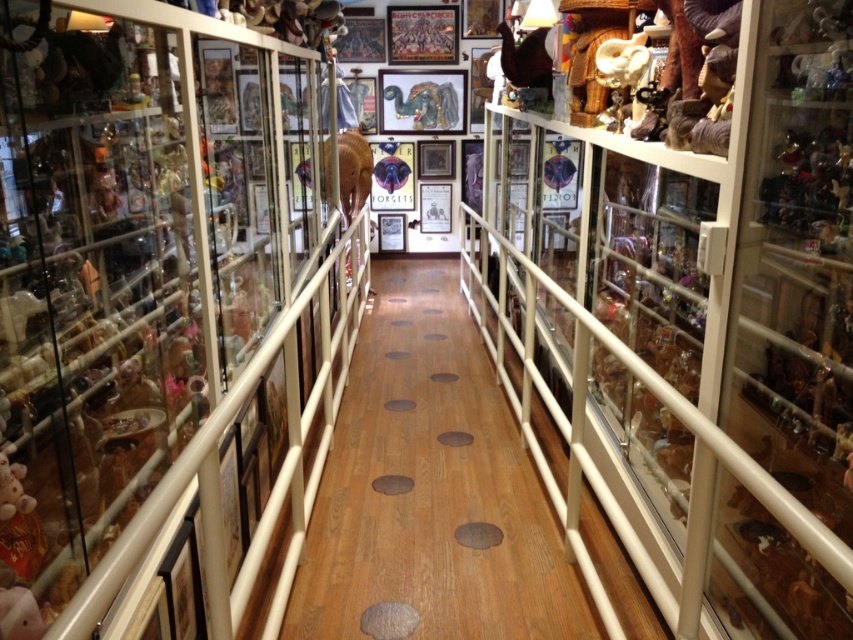
Question: Can you confirm if clear glass shelves at center is bigger than matte brown elephant at center?

Choices:
 (A) yes
 (B) no

Answer: (A)

Question: Does clear glass shelves at center have a lesser width compared to matte brown elephant at center?

Choices:
 (A) yes
 (B) no

Answer: (B)

Question: Among these points, which one is nearest to the camera?

Choices:
 (A) (148, 376)
 (B) (328, 186)

Answer: (A)

Question: Is clear glass shelves at center closer to the viewer compared to matte brown elephant at center?

Choices:
 (A) no
 (B) yes

Answer: (B)

Question: Among these points, which one is farthest from the camera?

Choices:
 (A) (363, 204)
 (B) (109, 456)

Answer: (A)

Question: Which object appears farthest from the camera in this image?

Choices:
 (A) clear glass shelves at center
 (B) matte brown elephant at center

Answer: (B)